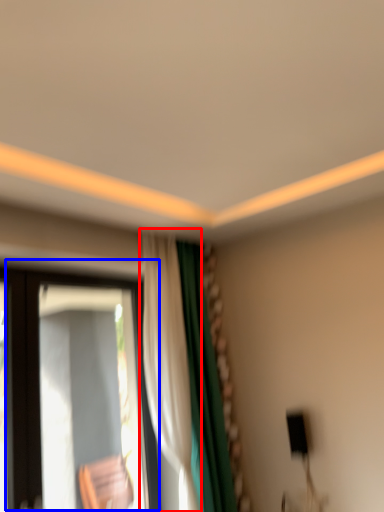
Question: Which object is closer to the camera taking this photo, curtain (highlighted by a red box) or window (highlighted by a blue box)?

Choices:
 (A) curtain
 (B) window

Answer: (B)